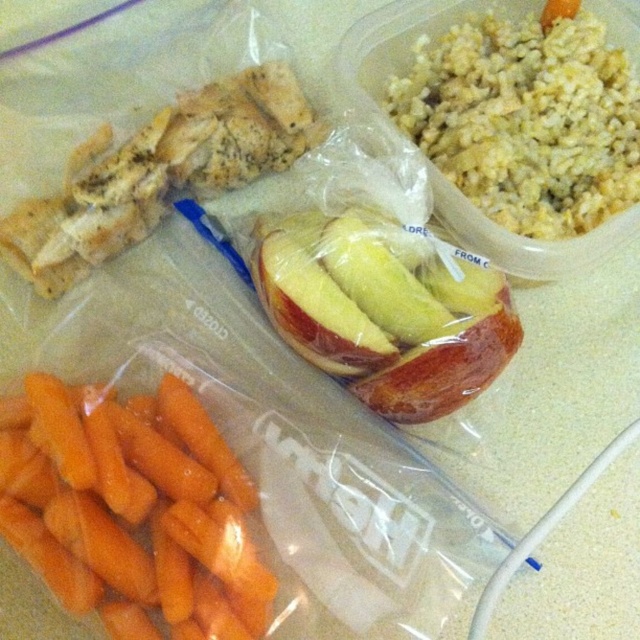
Looking at this image, does orange smooth skin carrots at lower left have a lesser height compared to red glossy apple at center?

Incorrect, orange smooth skin carrots at lower left's height does not fall short of red glossy apple at center's.

Looking at this image, can you confirm if orange smooth skin carrots at lower left is smaller than red glossy apple at center?

Indeed, orange smooth skin carrots at lower left has a smaller size compared to red glossy apple at center.

Does point (102, 531) come farther from viewer compared to point (490, 317)?

No, (102, 531) is in front of (490, 317).

Identify the location of orange smooth skin carrots at lower left. (131, 509).

Is orange smooth skin carrots at lower left further to the viewer compared to yellowish rice at upper right?

That is False.

Who is positioned more to the right, orange smooth skin carrots at lower left or yellowish rice at upper right?

From the viewer's perspective, yellowish rice at upper right appears more on the right side.

Image resolution: width=640 pixels, height=640 pixels. What do you see at coordinates (131, 509) in the screenshot? I see `orange smooth skin carrots at lower left` at bounding box center [131, 509].

This screenshot has width=640, height=640. I want to click on orange smooth skin carrots at lower left, so click(x=131, y=509).

Does yellowish rice at upper right have a greater width compared to red glossy apple at center?

Incorrect, yellowish rice at upper right's width does not surpass red glossy apple at center's.

Which is above, yellowish rice at upper right or red glossy apple at center?

yellowish rice at upper right is above.

Locate an element on the screen. yellowish rice at upper right is located at coordinates (525, 120).